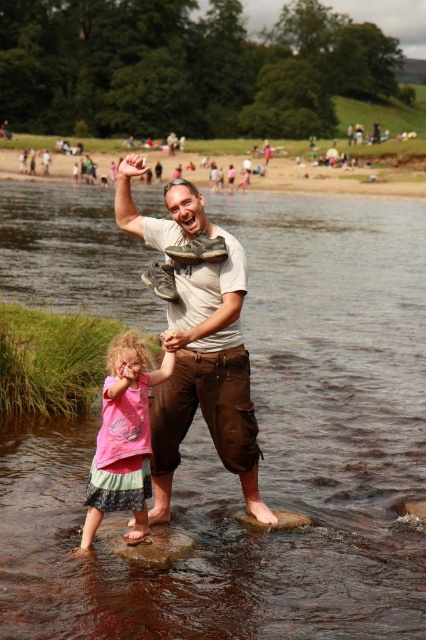
Question: Is pink fabric dress at lower left below smooth brown rock at center?

Choices:
 (A) yes
 (B) no

Answer: (B)

Question: Which object is closer to the camera taking this photo?

Choices:
 (A) brown smooth rock at lower center
 (B) pink fabric dress at lower left
 (C) light brown cotton pants at center

Answer: (B)

Question: Which point appears closest to the camera in this image?

Choices:
 (A) (83, 630)
 (B) (215, 266)

Answer: (A)

Question: Does light brown cotton pants at center appear on the right side of pink fabric dress at lower left?

Choices:
 (A) yes
 (B) no

Answer: (A)

Question: Does brown smooth rock at center have a smaller size compared to light brown cotton pants at center?

Choices:
 (A) yes
 (B) no

Answer: (B)

Question: Which of the following is the farthest from the observer?

Choices:
 (A) smooth brown rock at center
 (B) brown smooth rock at lower center
 (C) brown smooth rock at center
 (D) light brown cotton pants at center

Answer: (B)